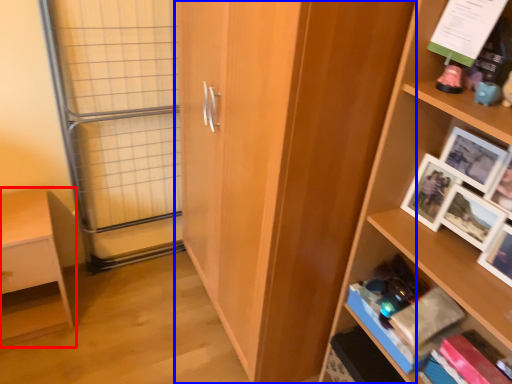
Question: Which object appears closest to the camera in this image, shelf (highlighted by a red box) or cupboard (highlighted by a blue box)?

Choices:
 (A) shelf
 (B) cupboard

Answer: (B)